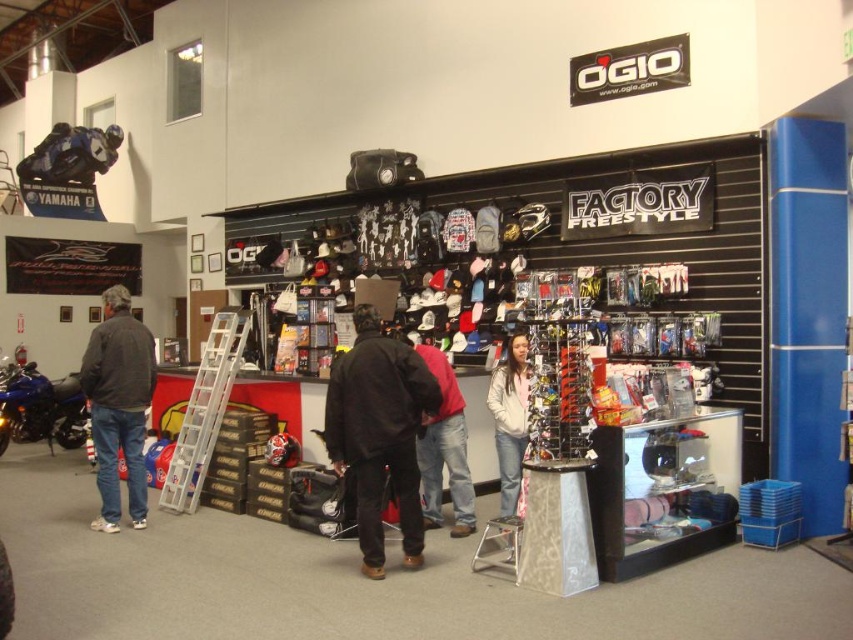
Question: Is black matte jacket at center to the left of white fleece jacket at center from the viewer's perspective?

Choices:
 (A) yes
 (B) no

Answer: (A)

Question: Which object is the closest to the red jacket at center?

Choices:
 (A) silver metallic stool at center
 (B) black matte jacket at center
 (C) blue metallic motorcycle at left

Answer: (A)

Question: Is blue metallic motorcycle at left behind white fleece jacket at center?

Choices:
 (A) no
 (B) yes

Answer: (B)

Question: Which of the following is the closest to the observer?

Choices:
 (A) (467, 524)
 (B) (154, 380)
 (C) (7, 387)
 (D) (498, 534)

Answer: (D)

Question: Can you confirm if black matte jacket at center is wider than blue metallic motorcycle at left?

Choices:
 (A) yes
 (B) no

Answer: (B)

Question: Which point is farther to the camera?

Choices:
 (A) silver metallic stool at center
 (B) blue metallic motorcycle at left
 (C) white fleece jacket at center

Answer: (B)